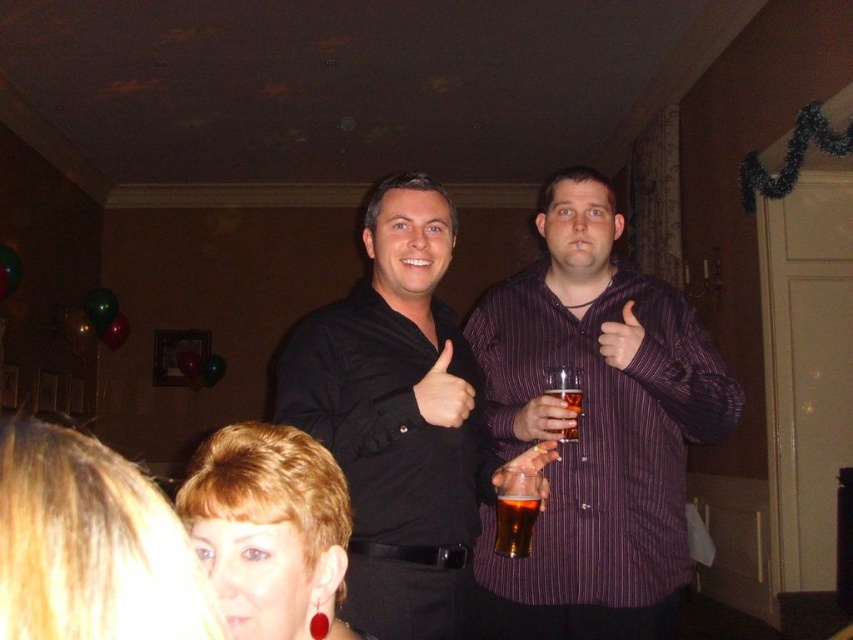
Is black matte shirt at center positioned in front of translucent glass beer at center?

Yes, black matte shirt at center is in front of translucent glass beer at center.

Is black matte shirt at center taller than translucent glass beer at center?

Correct, black matte shirt at center is much taller as translucent glass beer at center.

I want to click on black matte shirt at center, so click(x=399, y=419).

Which is above, blonde hair at lower left or shiny red earrings at lower left?

blonde hair at lower left

Can you confirm if blonde hair at lower left is thinner than shiny red earrings at lower left?

Yes.

The image size is (853, 640). Find the location of `blonde hair at lower left`. blonde hair at lower left is located at coordinates (90, 545).

Is shiny red earrings at lower left in front of translucent glass beer at center?

Yes, shiny red earrings at lower left is in front of translucent glass beer at center.

Can you confirm if shiny red earrings at lower left is bigger than translucent glass beer at center?

Correct, shiny red earrings at lower left is larger in size than translucent glass beer at center.

Between point (209, 541) and point (566, 394), which one is positioned in front?

Point (209, 541) is more forward.

Find the location of a particular element. The height and width of the screenshot is (640, 853). shiny red earrings at lower left is located at coordinates (270, 529).